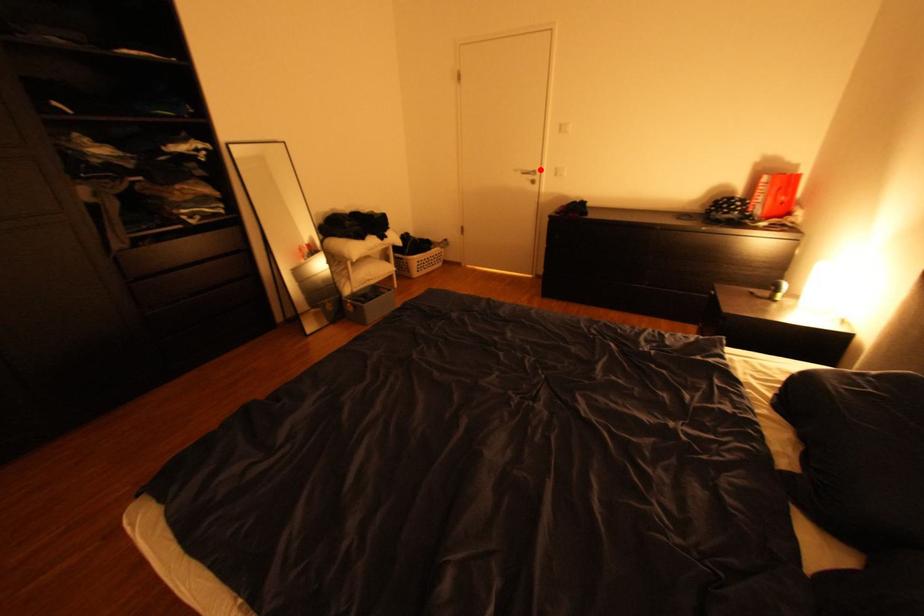
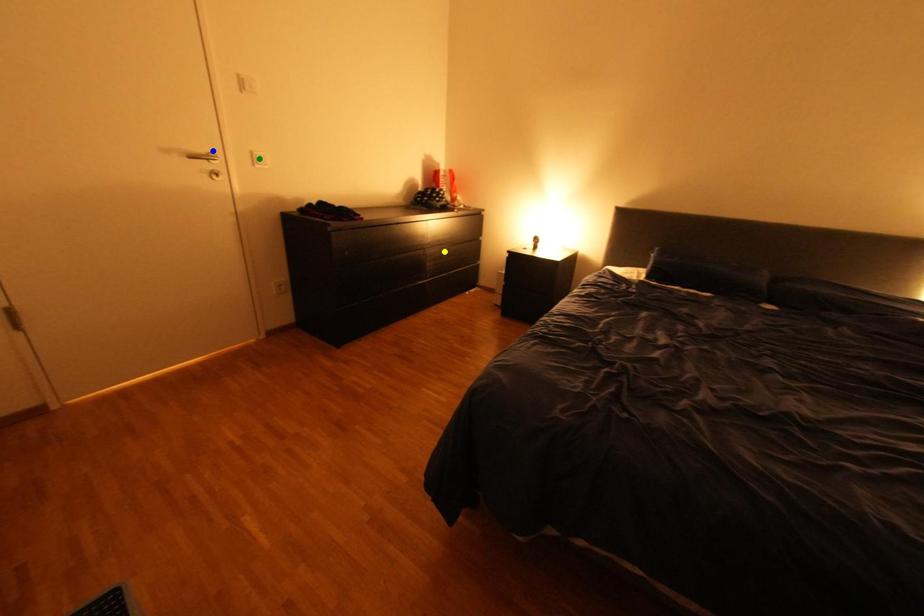
Question: I am providing you with two images of the same scene from different viewpoints. A red point is marked on the first image. You are given multiple points on the second image. Which spot in image 2 lines up with the point in image 1?

Choices:
 (A) blue point
 (B) green point
 (C) yellow point

Answer: (A)